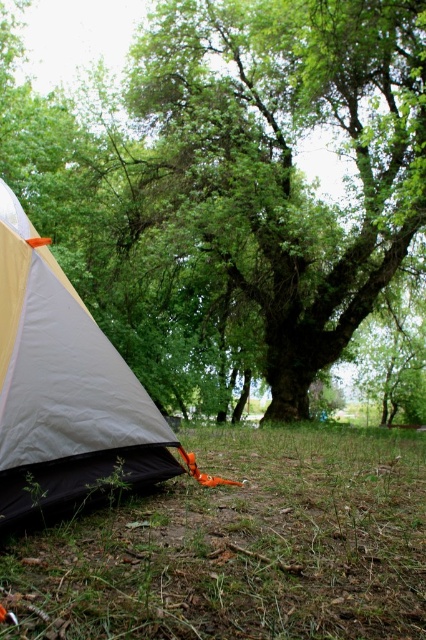
Between green leafy tree at center and green grass at lower center, which one has more height?

green leafy tree at center

What do you see at coordinates (282, 157) in the screenshot?
I see `green leafy tree at center` at bounding box center [282, 157].

Find the location of a particular element. This screenshot has height=640, width=426. green leafy tree at center is located at coordinates (282, 157).

At what (x,y) coordinates should I click in order to perform the action: click on green leafy tree at center. Please return your answer as a coordinate pair (x, y). The width and height of the screenshot is (426, 640). Looking at the image, I should click on (282, 157).

Consider the image. How far apart are green grass at lower center and matte white tent at lower left?

green grass at lower center and matte white tent at lower left are 22.61 inches apart from each other.

Which is behind, point (160, 492) or point (124, 385)?

Positioned behind is point (160, 492).

This screenshot has width=426, height=640. In order to click on green grass at lower center in this screenshot , I will do `click(241, 547)`.

Describe the element at coordinates (282, 157) in the screenshot. The image size is (426, 640). I see `green leafy tree at center` at that location.

Is green leafy tree at center taller than matte white tent at lower left?

Incorrect, green leafy tree at center's height is not larger of matte white tent at lower left's.

Is point (365, 67) closer to viewer compared to point (5, 349)?

No, it is behind (5, 349).

At what (x,y) coordinates should I click in order to perform the action: click on green leafy tree at center. Please return your answer as a coordinate pair (x, y). The width and height of the screenshot is (426, 640). Looking at the image, I should click on (282, 157).